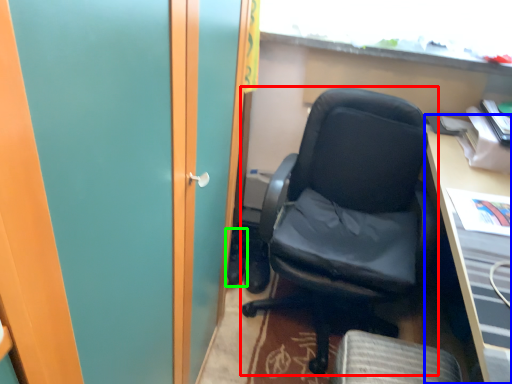
Question: Based on their relative distances, which object is farther from chair (highlighted by a red box)? Choose from desk (highlighted by a blue box) and footwear (highlighted by a green box).

Choices:
 (A) desk
 (B) footwear

Answer: (B)